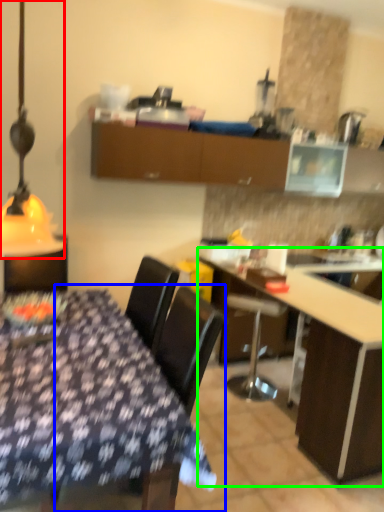
Question: Which object is positioned closest to table lamp (highlighted by a red box)? Select from chair (highlighted by a blue box) and table (highlighted by a green box).

Choices:
 (A) chair
 (B) table

Answer: (A)